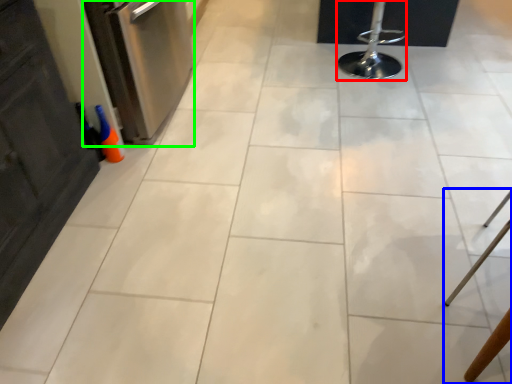
Question: Considering the real-world distances, which object is farthest from bar stool (highlighted by a red box)? furniture (highlighted by a blue box) or dish washer (highlighted by a green box)?

Choices:
 (A) furniture
 (B) dish washer

Answer: (A)